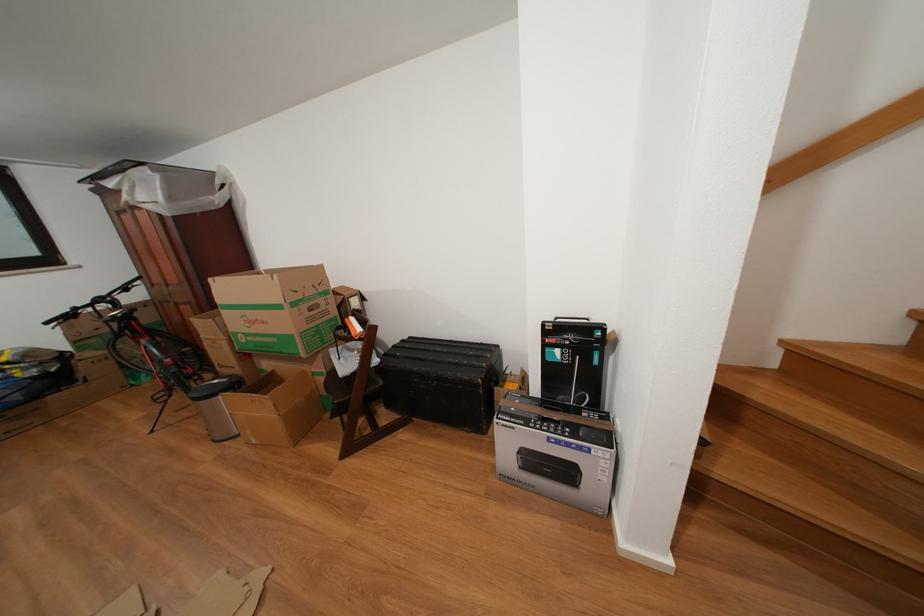
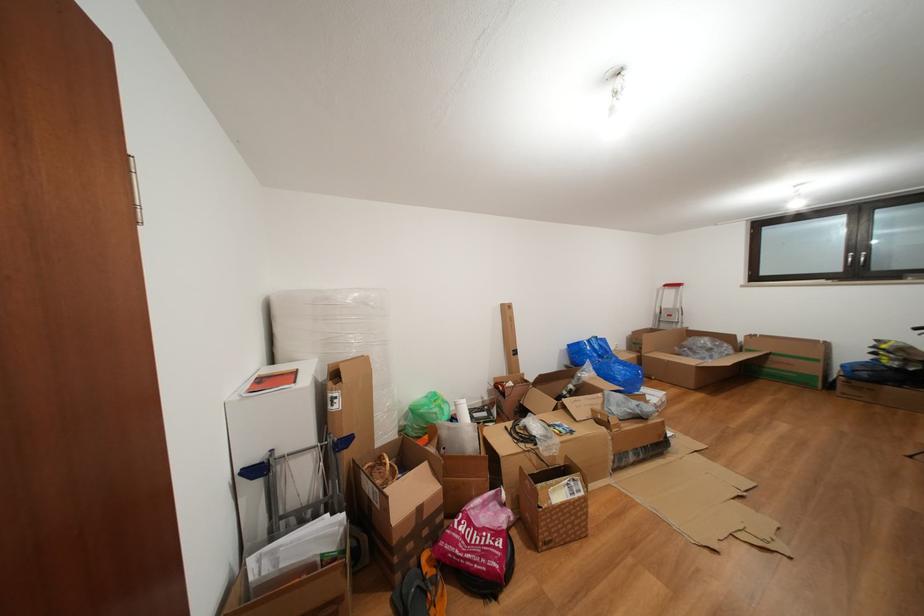
Where in the second image is the point corresponding to point (44, 402) from the first image?

(886, 387)